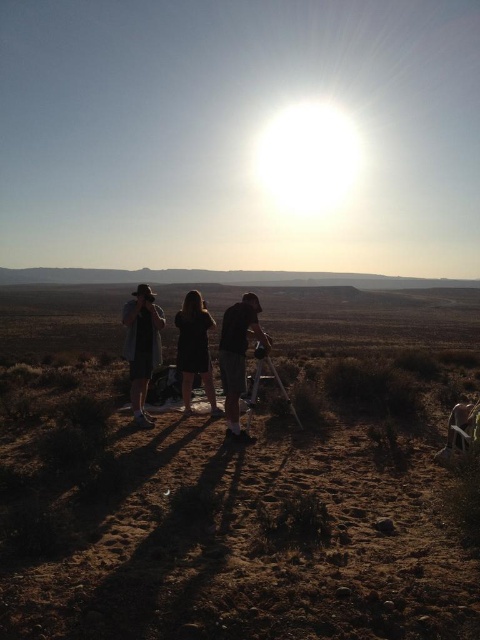
Which is below, brown dirt at center or dark gray fabric shirt at center?

dark gray fabric shirt at center is lower down.

Does brown dirt at center appear over dark gray fabric shirt at center?

Correct, brown dirt at center is located above dark gray fabric shirt at center.

Is point (259, 273) closer to viewer compared to point (240, 429)?

No, it is not.

Where is `brown dirt at center`? This screenshot has width=480, height=640. brown dirt at center is located at coordinates (220, 276).

Consider the image. Does dark gray shirt at center have a smaller size compared to dark gray fabric shirt at center?

Actually, dark gray shirt at center might be larger than dark gray fabric shirt at center.

In order to click on dark gray shirt at center in this screenshot , I will do `click(142, 348)`.

Is black fabric dress at center to the left of matte black tripod at center from the viewer's perspective?

Correct, you'll find black fabric dress at center to the left of matte black tripod at center.

I want to click on black fabric dress at center, so click(194, 348).